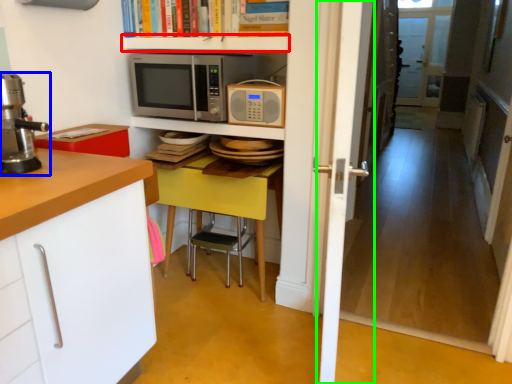
Question: Estimate the real-world distances between objects in this image. Which object is closer to shelf (highlighted by a red box), home appliance (highlighted by a blue box) or door (highlighted by a green box)?

Choices:
 (A) home appliance
 (B) door

Answer: (B)